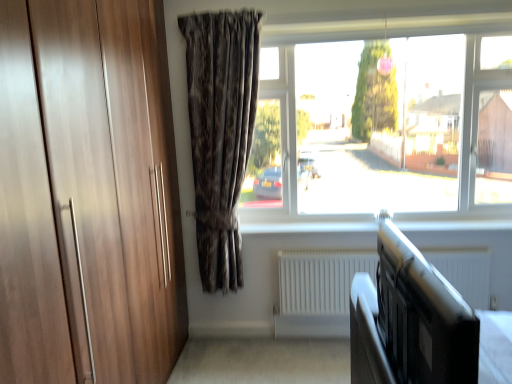
Question: Are transparent glass window at center and white matte radiator at lower center far apart?

Choices:
 (A) no
 (B) yes

Answer: (A)

Question: Does transparent glass window at center come in front of white matte radiator at lower center?

Choices:
 (A) yes
 (B) no

Answer: (A)

Question: Does transparent glass window at center contain white matte radiator at lower center?

Choices:
 (A) yes
 (B) no

Answer: (B)

Question: Is transparent glass window at center behind white matte radiator at lower center?

Choices:
 (A) no
 (B) yes

Answer: (A)

Question: Could you tell me if transparent glass window at center is facing white matte radiator at lower center?

Choices:
 (A) yes
 (B) no

Answer: (B)

Question: Is transparent glass window at center oriented away from white matte radiator at lower center?

Choices:
 (A) no
 (B) yes

Answer: (A)

Question: From a real-world perspective, is black matte bed frame at lower right over transparent glass window at center?

Choices:
 (A) no
 (B) yes

Answer: (A)

Question: From the image's perspective, is black matte bed frame at lower right beneath transparent glass window at center?

Choices:
 (A) no
 (B) yes

Answer: (B)

Question: Is black matte bed frame at lower right thinner than transparent glass window at center?

Choices:
 (A) yes
 (B) no

Answer: (A)

Question: Considering the relative sizes of black matte bed frame at lower right and transparent glass window at center in the image provided, is black matte bed frame at lower right shorter than transparent glass window at center?

Choices:
 (A) no
 (B) yes

Answer: (B)

Question: Is black matte bed frame at lower right facing towards transparent glass window at center?

Choices:
 (A) yes
 (B) no

Answer: (B)

Question: Does black matte bed frame at lower right have a larger size compared to transparent glass window at center?

Choices:
 (A) yes
 (B) no

Answer: (B)

Question: Is transparent glass window at center not inside black matte bed frame at lower right?

Choices:
 (A) no
 (B) yes

Answer: (B)